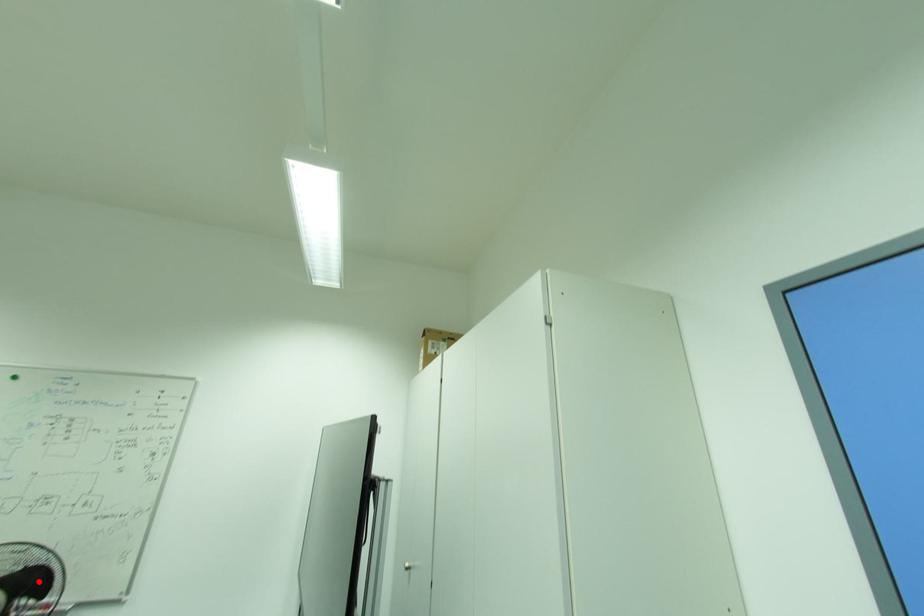
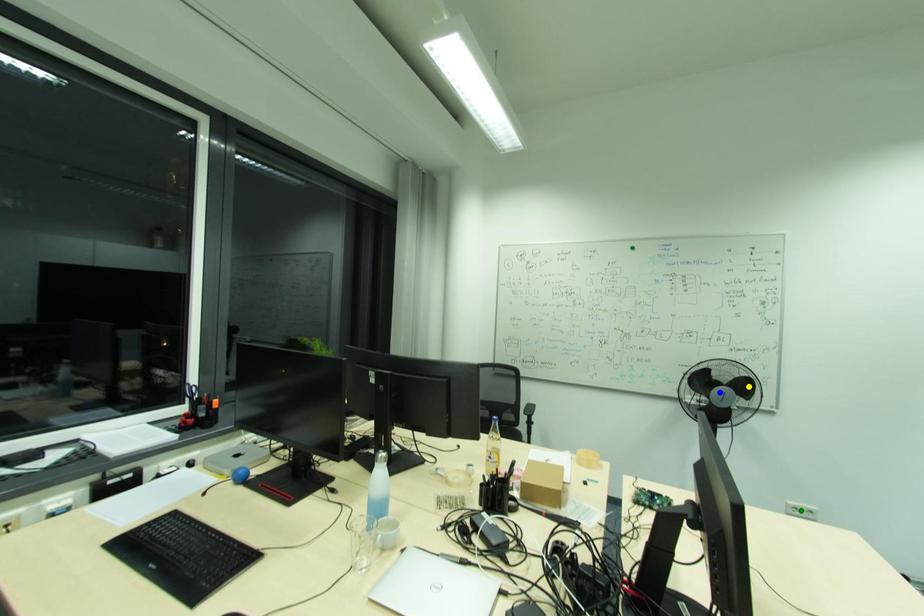
Question: I am providing you with two images of the same scene from different viewpoints. A red point is marked on the first image. You are given multiple points on the second image. In image 2, which mark is for the same physical point as the one in image 1?

Choices:
 (A) green point
 (B) blue point
 (C) yellow point

Answer: (C)